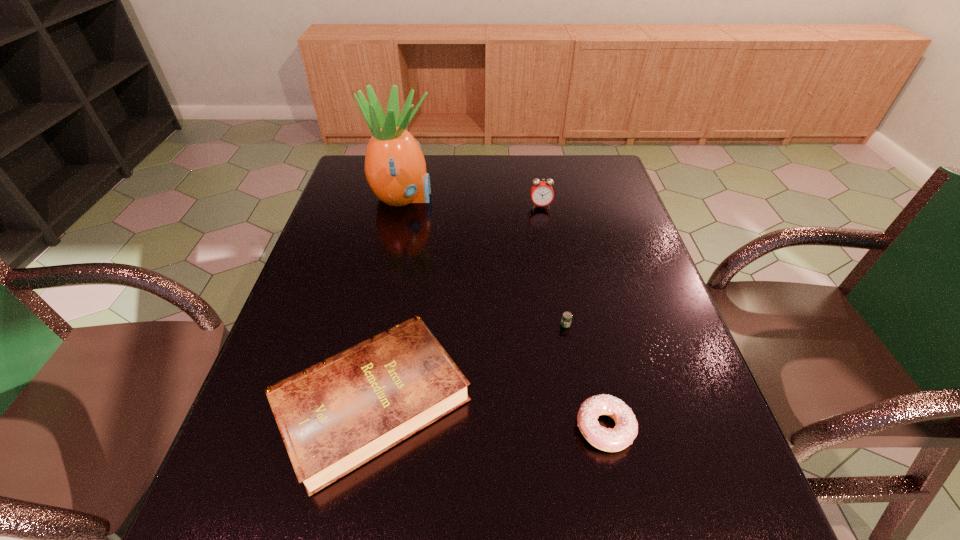
I want to click on object that is positioned at the far edge, so click(x=395, y=167).

Locate an element on the screen. The width and height of the screenshot is (960, 540). pineapple positioned at the left edge is located at coordinates (395, 167).

At what (x,y) coordinates should I click in order to perform the action: click on hardback book that is at the left edge. Please return your answer as a coordinate pair (x, y). The width and height of the screenshot is (960, 540). Looking at the image, I should click on 336,415.

What are the coordinates of `object located at the far left corner` in the screenshot? It's located at (395, 167).

This screenshot has width=960, height=540. I want to click on free region at the far edge of the desktop, so click(500, 161).

Find the location of a particular element. blank space at the left edge of the desktop is located at coordinates (342, 309).

This screenshot has height=540, width=960. Find the location of `free space at the right edge`. free space at the right edge is located at coordinates (616, 218).

What are the coordinates of `free space at the far right corner of the desktop` in the screenshot? It's located at 607,160.

The height and width of the screenshot is (540, 960). In order to click on vacant space at the near right corner of the desktop in this screenshot , I will do `click(725, 511)`.

Locate an element on the screen. Image resolution: width=960 pixels, height=540 pixels. vacant space in between the shortest object and the third tallest object is located at coordinates (468, 363).